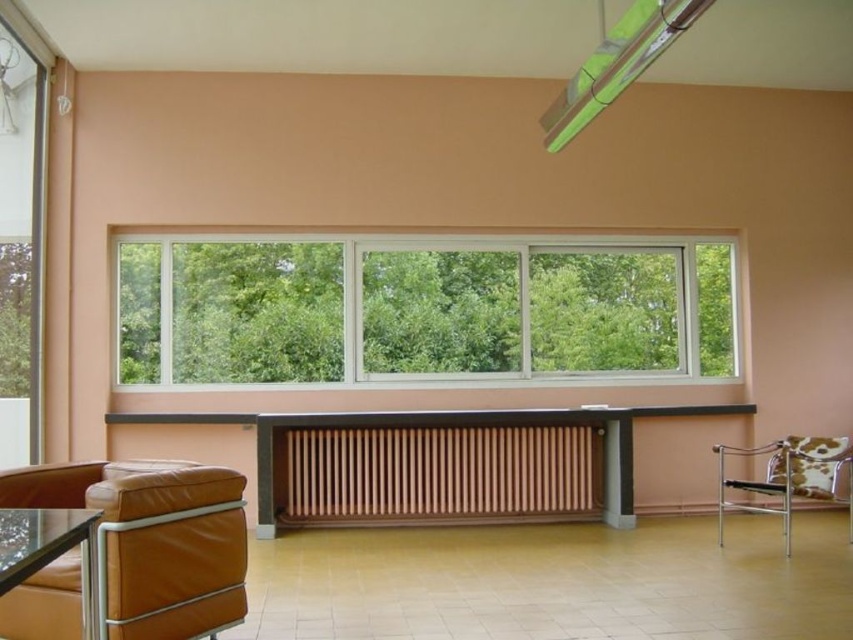
Is wooden slats radiator at center to the right of cow print fabric chair at right from the viewer's perspective?

In fact, wooden slats radiator at center is to the left of cow print fabric chair at right.

Does point (355, 504) lie in front of point (813, 492)?

No.

Where is `wooden slats radiator at center`? The width and height of the screenshot is (853, 640). wooden slats radiator at center is located at coordinates (437, 474).

Does wooden slats radiator at center have a lesser height compared to transparent glass table at lower left?

No, wooden slats radiator at center is not shorter than transparent glass table at lower left.

In the scene shown: Is wooden slats radiator at center further to the viewer compared to transparent glass table at lower left?

Yes, wooden slats radiator at center is behind transparent glass table at lower left.

Find the location of a particular element. The image size is (853, 640). wooden slats radiator at center is located at coordinates (437, 474).

Does clear glass window at center have a greater height compared to transparent glass table at lower left?

Yes.

Does clear glass window at center appear on the right side of transparent glass table at lower left?

Correct, you'll find clear glass window at center to the right of transparent glass table at lower left.

At what (x,y) coordinates should I click in order to perform the action: click on clear glass window at center. Please return your answer as a coordinate pair (x, y). Looking at the image, I should click on (421, 308).